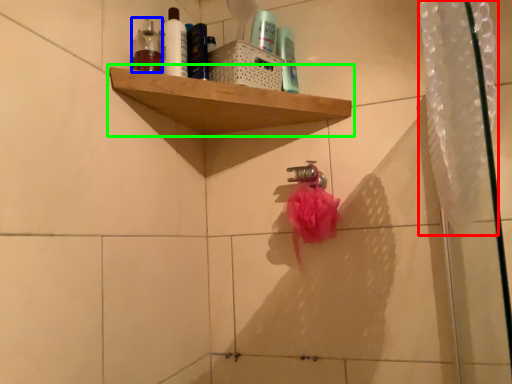
Question: Which is farther away from shower curtain (highlighted by a red box)? toiletry (highlighted by a blue box) or shelf (highlighted by a green box)?

Choices:
 (A) toiletry
 (B) shelf

Answer: (A)